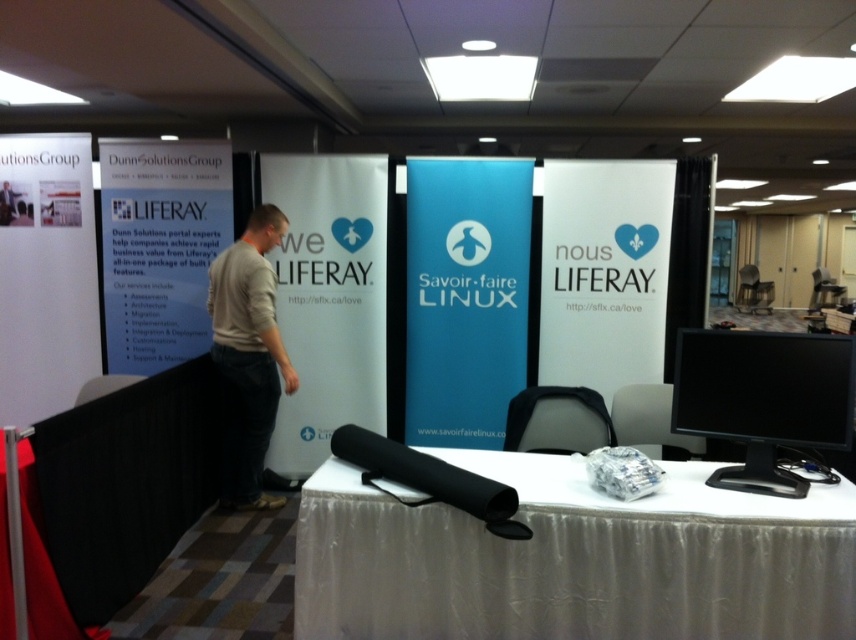
You are setting up a presentation at the booth and need to place a laptop on the white fabric table at center and the black glossy monitor at right. Which object should you place the laptop on to ensure it is closer to the left side of the booth?

The white fabric table at center is positioned on the left side of the black glossy monitor at right, so placing the laptop on the white fabric table at center would ensure it is closer to the left side of the booth.

You are standing at the entrance of the conference booth and want to approach the white fabric table at center. Based on its 2D coordinates, in which general direction should you move from the entrance to reach it?

The white fabric table at center is located at coordinates point (x=574, y=560), so you should move towards the upper right direction from the entrance to reach it.